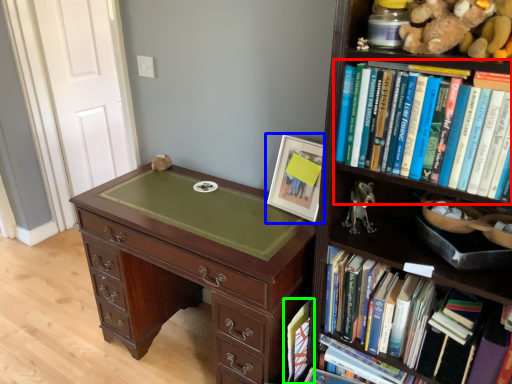
Question: Which object is positioned closest to book (highlighted by a red box)? Select from picture frame (highlighted by a blue box) and book (highlighted by a green box).

Choices:
 (A) picture frame
 (B) book

Answer: (A)